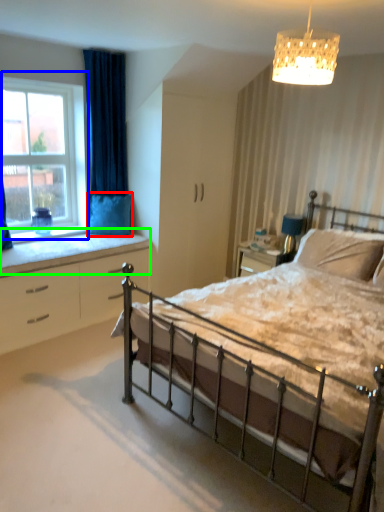
Question: Considering the real-world distances, which object is closest to pillow (highlighted by a red box)? window (highlighted by a blue box) or window sill (highlighted by a green box).

Choices:
 (A) window
 (B) window sill

Answer: (B)